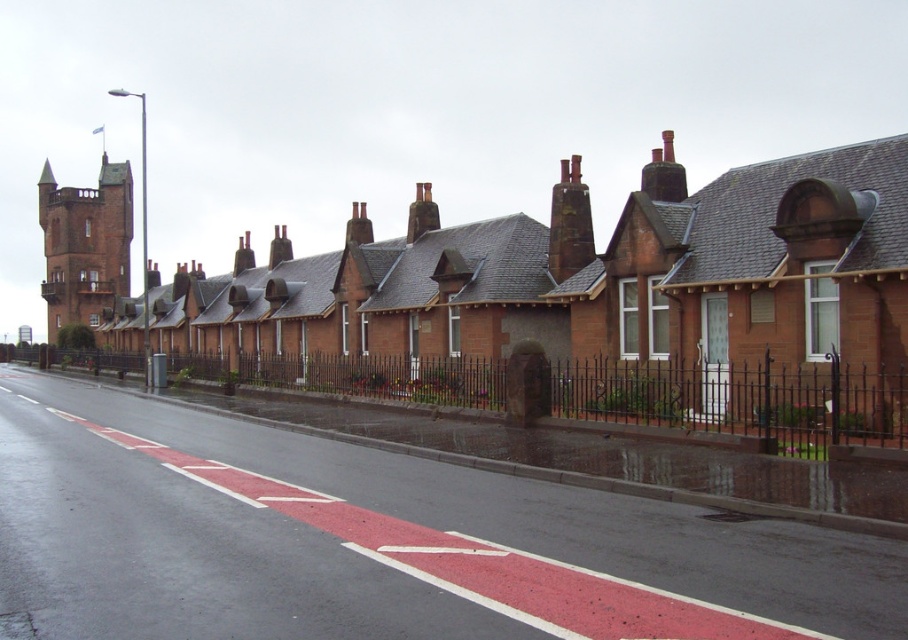
You are a delivery driver who needs to park your van on the red asphalt road at center. However, there is a rusty metal chimney at center nearby. Considering their sizes, will there be enough space for your van to park without touching the chimney?

The red asphalt road at center has a larger size compared to the rusty metal chimney at center. Since the road is bigger, there should be sufficient space to park the van without touching the chimney.

You are standing at the edge of the road and want to cross to the other side. Where exactly is the red asphalt road at center located in the image?

The red asphalt road at center is located at point (x=324, y=540) in the image.

You are a pedestrian standing on the sidewalk and want to walk to the matte brick church at center. Which direction should you go relative to the red asphalt road at center?

You should walk towards the matte brick church at center, which is behind the red asphalt road at center, so you need to cross the road to reach it.